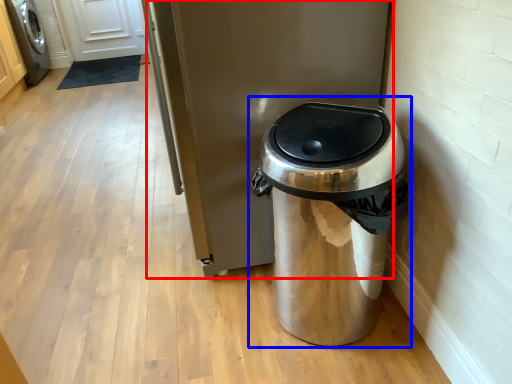
Question: Which of the following is the closest to the observer, appliance (highlighted by a red box) or waste container (highlighted by a blue box)?

Choices:
 (A) appliance
 (B) waste container

Answer: (B)